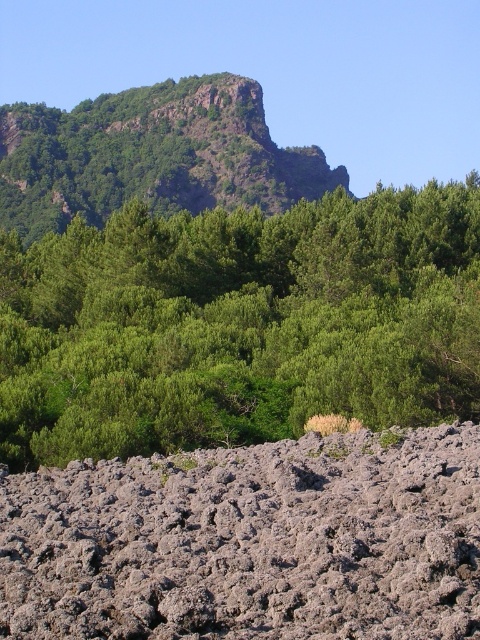
Question: Is the position of gray rough rock at lower center more distant than that of rugged rock mountain at upper center?

Choices:
 (A) no
 (B) yes

Answer: (A)

Question: Which object is the farthest from the gray rough rock at lower center?

Choices:
 (A) green leafy tree at upper center
 (B) rugged rock mountain at upper center

Answer: (B)

Question: Which point is closer to the camera?

Choices:
 (A) gray rough rock at lower center
 (B) green leafy tree at upper center
 (C) rugged rock mountain at upper center

Answer: (A)

Question: Is green leafy tree at upper center wider than gray rough rock at lower center?

Choices:
 (A) no
 (B) yes

Answer: (B)

Question: Which point appears closest to the camera in this image?

Choices:
 (A) [249, 90]
 (B) [408, 371]

Answer: (B)

Question: Does green leafy tree at upper center appear on the left side of gray rough rock at lower center?

Choices:
 (A) yes
 (B) no

Answer: (A)